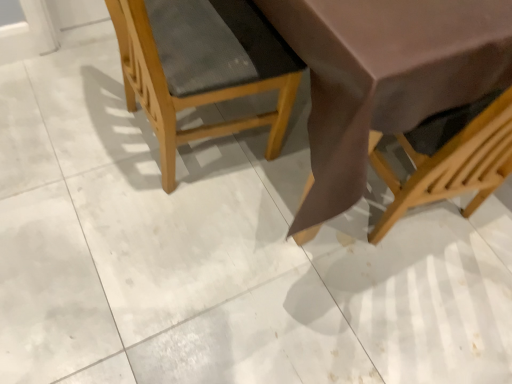
Question: Is matte brown chair at right, which is the 2th chair from left to right, looking in the opposite direction of wooden textured chair at center, the second chair when ordered from right to left?

Choices:
 (A) yes
 (B) no

Answer: (B)

Question: Does matte brown chair at right, which is the 2th chair from left to right, turn towards wooden textured chair at center, the first chair from the left?

Choices:
 (A) no
 (B) yes

Answer: (A)

Question: Can you confirm if matte brown chair at right, the first chair viewed from the right, is positioned to the right of wooden textured chair at center, the second chair when ordered from right to left?

Choices:
 (A) no
 (B) yes

Answer: (B)

Question: Does matte brown chair at right, the first chair viewed from the right, have a greater height compared to wooden textured chair at center, the second chair when ordered from right to left?

Choices:
 (A) no
 (B) yes

Answer: (B)

Question: Is matte brown chair at right, the first chair viewed from the right, next to wooden textured chair at center, the first chair from the left, and touching it?

Choices:
 (A) yes
 (B) no

Answer: (B)

Question: Does matte brown chair at right, which is the 2th chair from left to right, have a smaller size compared to wooden textured chair at center, the second chair when ordered from right to left?

Choices:
 (A) no
 (B) yes

Answer: (A)

Question: Is wooden textured chair at center, the first chair from the left, facing away from matte brown chair at right, which is the 2th chair from left to right?

Choices:
 (A) yes
 (B) no

Answer: (B)

Question: Is wooden textured chair at center, the first chair from the left, next to matte brown chair at right, which is the 2th chair from left to right?

Choices:
 (A) yes
 (B) no

Answer: (B)

Question: Is wooden textured chair at center, the second chair when ordered from right to left, to the right of matte brown chair at right, the first chair viewed from the right, from the viewer's perspective?

Choices:
 (A) no
 (B) yes

Answer: (A)

Question: Considering the relative sizes of wooden textured chair at center, the second chair when ordered from right to left, and matte brown chair at right, which is the 2th chair from left to right, in the image provided, is wooden textured chair at center, the second chair when ordered from right to left, taller than matte brown chair at right, which is the 2th chair from left to right,?

Choices:
 (A) no
 (B) yes

Answer: (A)

Question: From a real-world perspective, does wooden textured chair at center, the first chair from the left, sit lower than matte brown chair at right, the first chair viewed from the right?

Choices:
 (A) yes
 (B) no

Answer: (A)

Question: Would you say wooden textured chair at center, the second chair when ordered from right to left, contains matte brown chair at right, the first chair viewed from the right?

Choices:
 (A) yes
 (B) no

Answer: (B)

Question: Looking at their shapes, would you say wooden textured chair at center, the second chair when ordered from right to left, is wider or thinner than matte brown chair at right, which is the 2th chair from left to right?

Choices:
 (A) thin
 (B) wide

Answer: (A)